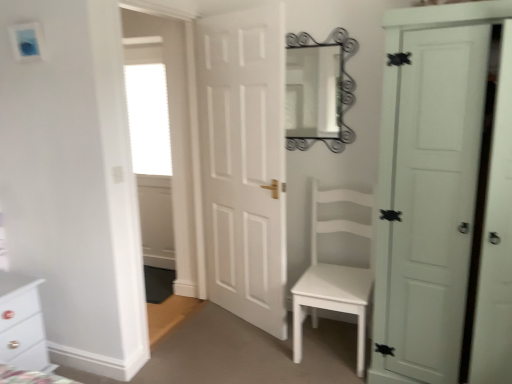
Find the location of `empty space that is ontop of white matte door at center, which appears as the second door when viewed from the right (from a real-world perspective)`. empty space that is ontop of white matte door at center, which appears as the second door when viewed from the right (from a real-world perspective) is located at coordinates (230, 10).